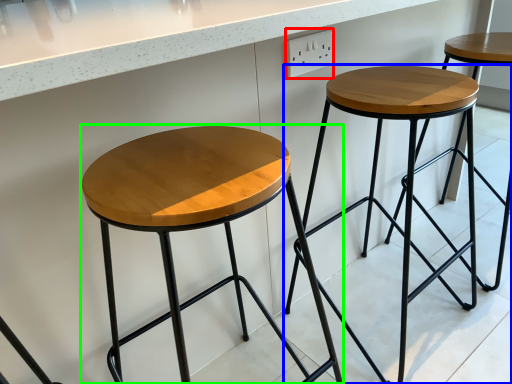
Question: Which is farther away from electric outlet (highlighted by a red box)? stool (highlighted by a blue box) or stool (highlighted by a green box)?

Choices:
 (A) stool
 (B) stool

Answer: (B)